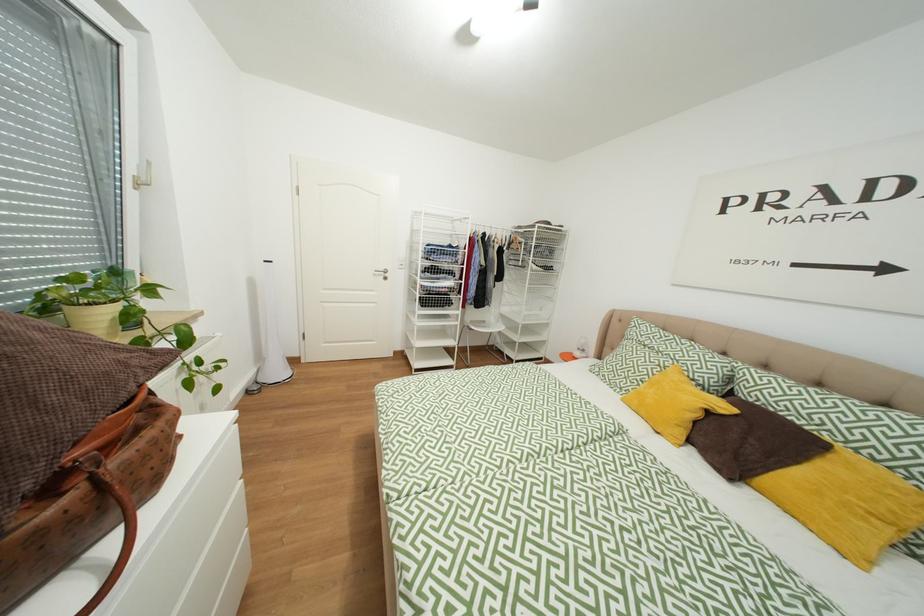
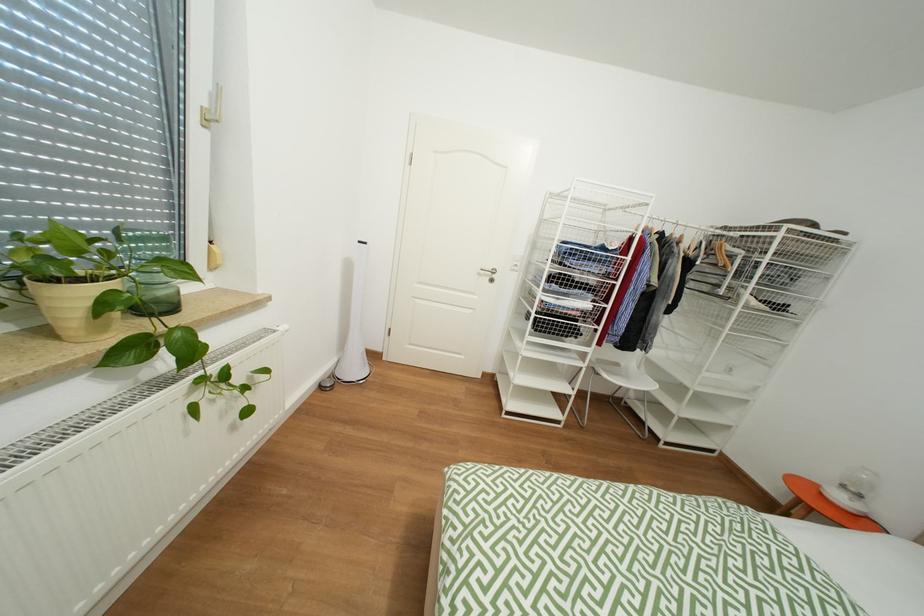
Which direction would the cameraman need to move to produce the second image?

The cameraman moved toward left, forward.